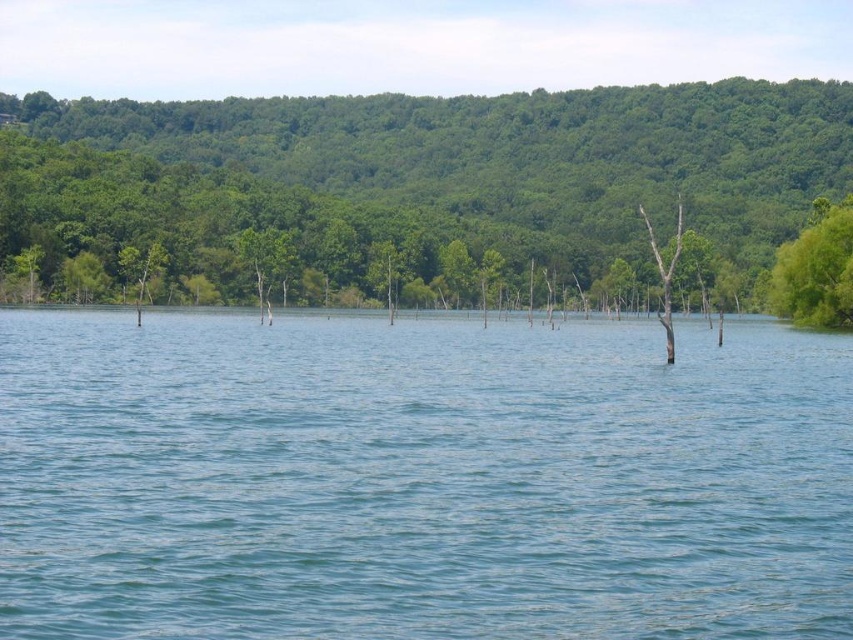
Question: Which object is positioned closest to the green leafy tree at right?

Choices:
 (A) brown wood tree at center
 (B) blue liquid water at center
 (C) green leafy tree at upper center

Answer: (A)

Question: Is blue liquid water at center below green leafy tree at right?

Choices:
 (A) yes
 (B) no

Answer: (A)

Question: Which is nearer to the brown wood tree at center?

Choices:
 (A) green leafy tree at right
 (B) green leafy tree at upper center
 (C) blue liquid water at center

Answer: (A)

Question: Can you confirm if blue liquid water at center is positioned to the right of green leafy tree at upper center?

Choices:
 (A) yes
 (B) no

Answer: (A)

Question: Which point is farther to the camera?

Choices:
 (A) (666, 332)
 (B) (805, 288)
 (C) (292, 248)

Answer: (C)

Question: Can you confirm if blue liquid water at center is wider than green leafy tree at right?

Choices:
 (A) yes
 (B) no

Answer: (A)